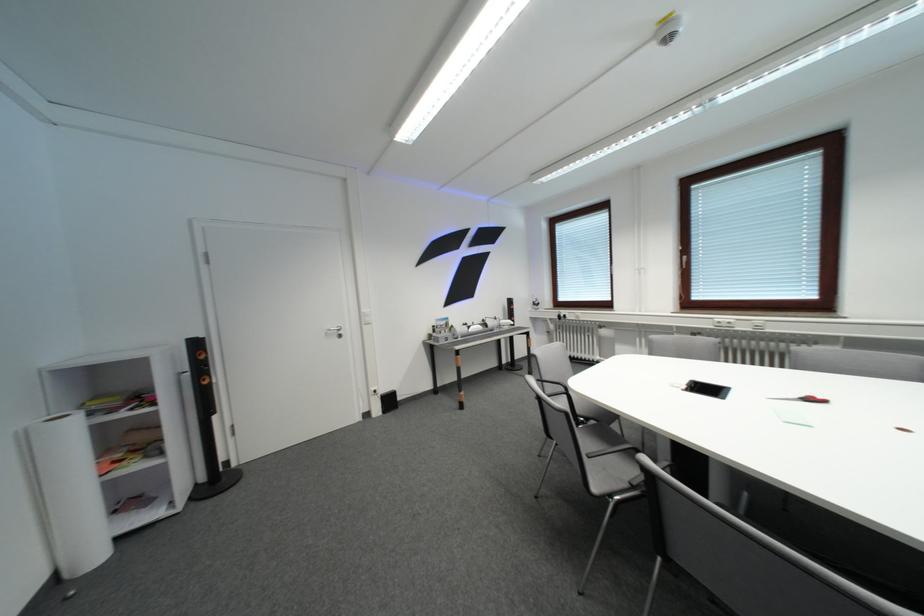
This screenshot has height=616, width=924. I want to click on chair sitting surface, so click(610, 447).